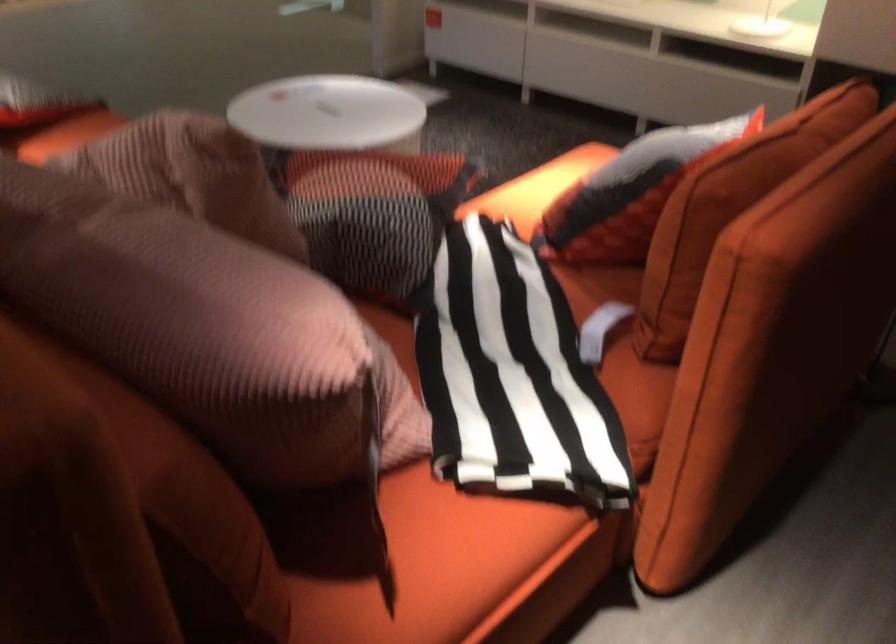
Find where to sit the sofa sitting surface. Please return your answer as a coordinate pair (x, y).

(434, 565)